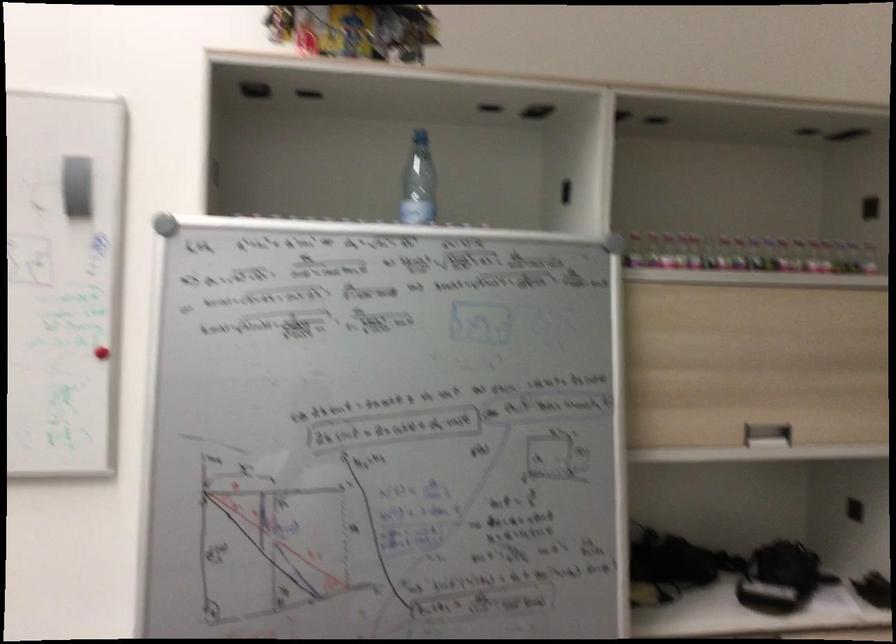
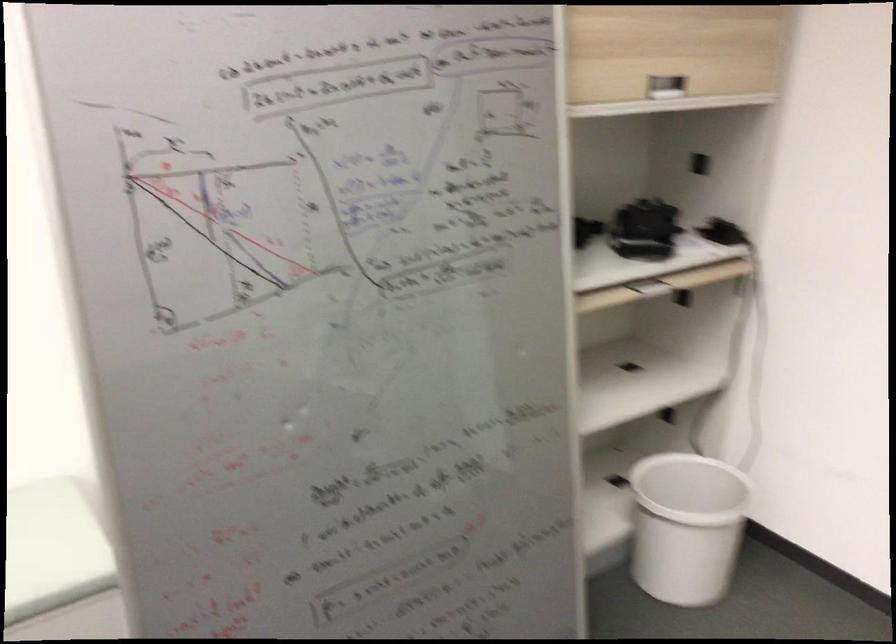
Looking at this image, how did the camera likely rotate?

The camera rotated toward right-down.